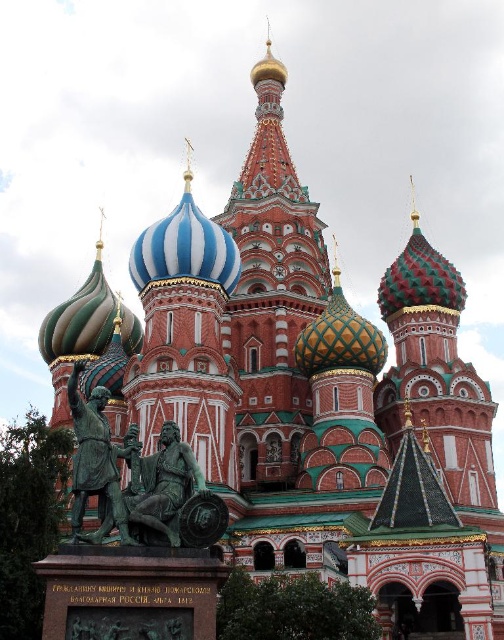
Is blue striped dome at center positioned behind bronze statue at lower left?

Yes, it is.

Measure the distance from blue striped dome at center to bronze statue at lower left.

blue striped dome at center and bronze statue at lower left are 30.81 meters apart.

Is point (190, 205) farther from camera compared to point (98, 474)?

Yes.

Find the location of a particular element. blue striped dome at center is located at coordinates (184, 248).

Does green patinated bronze statue at lower left appear on the left side of blue striped dome at center?

Correct, you'll find green patinated bronze statue at lower left to the left of blue striped dome at center.

Is point (85, 458) in front of point (133, 250)?

That is True.

Between point (155, 513) and point (234, 276), which one is positioned behind?

Positioned behind is point (234, 276).

I want to click on green patinated bronze statue at lower left, so click(x=140, y=481).

Is green patinated bronze statue at lower left closer to camera compared to bronze statue at lower left?

That is True.

Between green patinated bronze statue at lower left and bronze statue at lower left, which one has less height?

Standing shorter between the two is bronze statue at lower left.

Who is more forward, (204, 515) or (75, 452)?

Positioned in front is point (204, 515).

This screenshot has width=504, height=640. I want to click on green patinated bronze statue at lower left, so click(x=140, y=481).